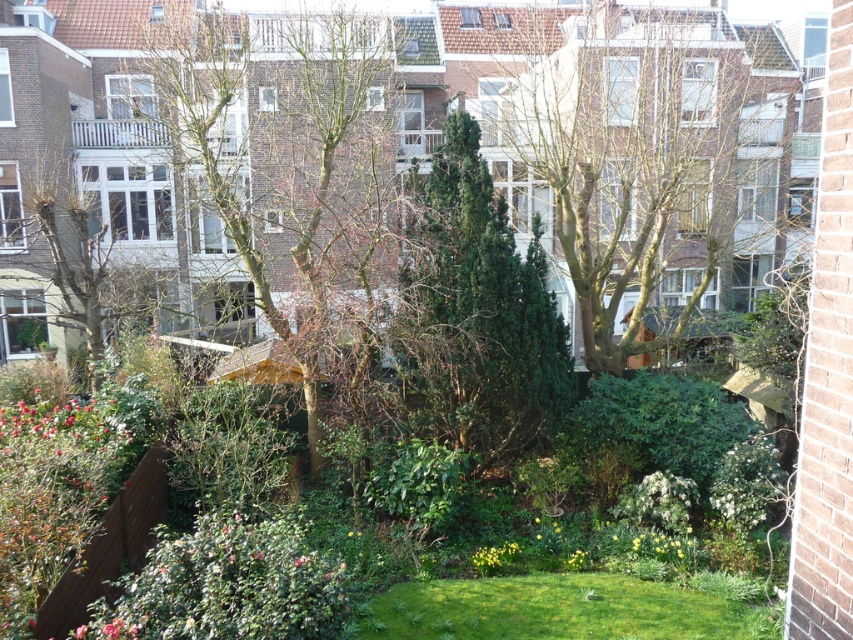
You are a landscape architect designing a garden layout. You have two plants to place in the garden plot. The first is the bare branches at center, and the second is the green leafy bush at lower left. If you want to ensure there is enough space between them, which plant requires more horizontal space?

The bare branches at center requires more horizontal space since its width surpasses that of the green leafy bush at lower left.

Consider the image. You are standing on a balcony overlooking the urban garden. There is a point marked at coordinates [293,168] in the scene. What object does this point correspond to?

The point at coordinates [293,168] corresponds to the bare branches at center.

You are standing in the garden and want to walk towards the green leafy tree at center and the green textured tree at center. Which tree should you approach first if you want to reach the one that is closer to you?

The green textured tree at center is closer to you, so you should approach it first.